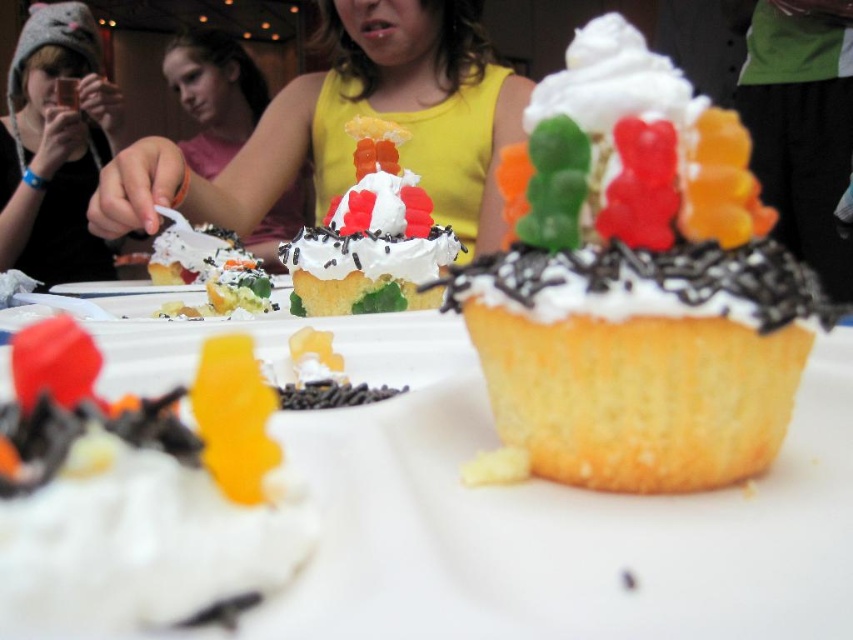
Question: Does yellow fabric at center appear under knitted gray hat at upper left?

Choices:
 (A) yes
 (B) no

Answer: (A)

Question: Which point is closer to the camera?

Choices:
 (A) knitted gray hat at upper left
 (B) yellow fabric at center
 (C) gummy bear cupcake at center

Answer: (C)

Question: Is yellow fabric at center to the right of knitted gray hat at upper left from the viewer's perspective?

Choices:
 (A) no
 (B) yes

Answer: (B)

Question: Observing the image, what is the correct spatial positioning of yellow cake with chocolate sprinkles at center in reference to gummy bear cupcake at center?

Choices:
 (A) below
 (B) above

Answer: (A)

Question: Based on their relative distances, which object is nearer to the yellow fabric at center?

Choices:
 (A) gummy bear cupcake at center
 (B) knitted gray hat at upper left

Answer: (A)

Question: Which object is the closest to the yellow fabric at center?

Choices:
 (A) knitted gray hat at upper left
 (B) white fluffy frosting at center

Answer: (A)